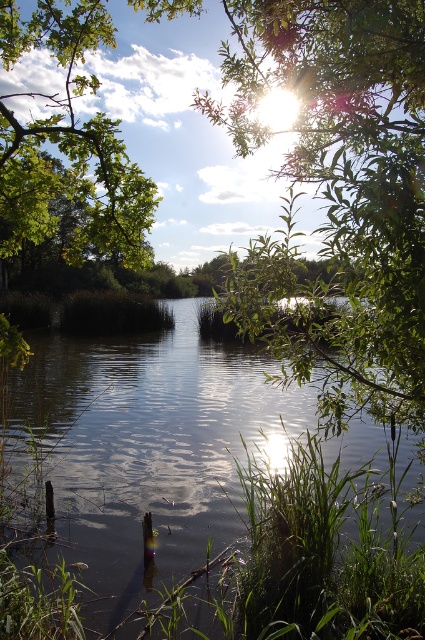
Can you confirm if smooth dark water at center is shorter than green leafy tree at upper center?

Indeed, smooth dark water at center has a lesser height compared to green leafy tree at upper center.

Which is more to the left, smooth dark water at center or green leafy tree at upper center?

Positioned to the left is green leafy tree at upper center.

The width and height of the screenshot is (425, 640). Describe the element at coordinates (206, 493) in the screenshot. I see `smooth dark water at center` at that location.

This screenshot has width=425, height=640. I want to click on smooth dark water at center, so click(x=206, y=493).

Does smooth dark water at center appear on the left side of green leafy tree at upper left?

In fact, smooth dark water at center is to the right of green leafy tree at upper left.

Does point (36, 419) come in front of point (17, 132)?

No, (36, 419) is further to viewer.

Locate an element on the screen. smooth dark water at center is located at coordinates (206, 493).

Between green leafy tree at upper center and green leafy tree at upper left, which one appears on the right side from the viewer's perspective?

Positioned to the right is green leafy tree at upper center.

Who is higher up, green leafy tree at upper center or green leafy tree at upper left?

green leafy tree at upper left is above.

Where is `green leafy tree at upper center`? This screenshot has width=425, height=640. green leafy tree at upper center is located at coordinates (337, 188).